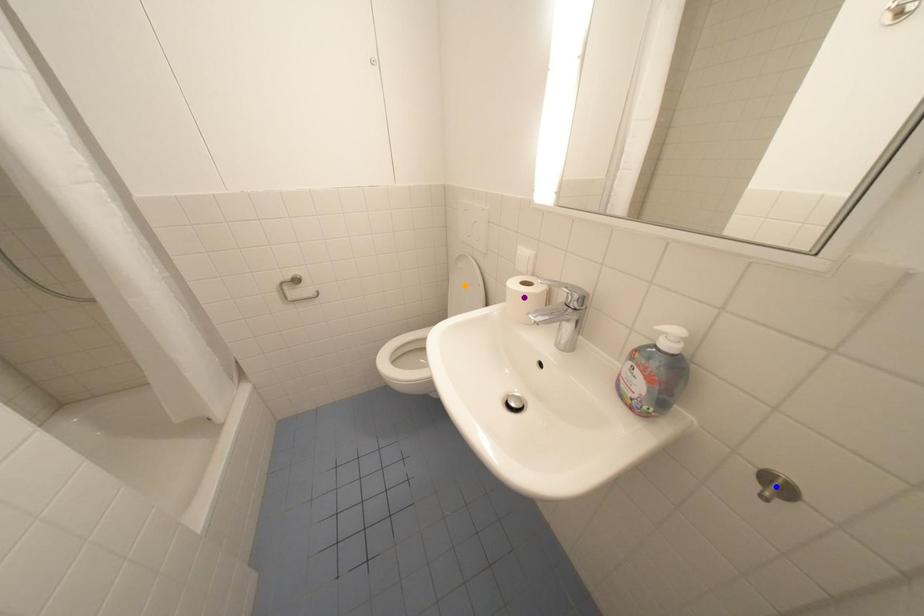
Order these from farthest to nearest:
- purple point
- blue point
- orange point

orange point
purple point
blue point